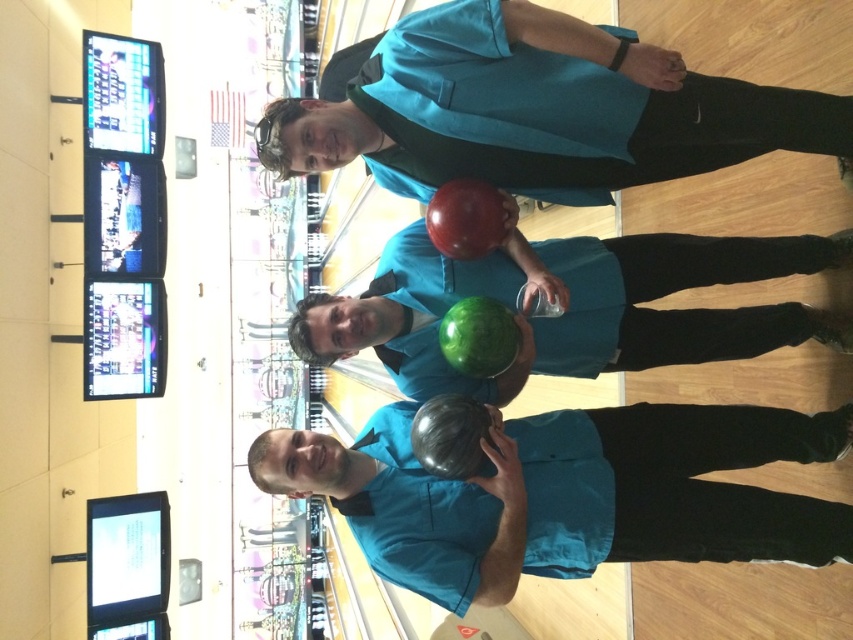
Between matte teal bowling ball at upper center and shiny green bowling ball at center, which one has more height?

Standing taller between the two is shiny green bowling ball at center.

From the picture: Does matte teal bowling ball at upper center have a lesser width compared to shiny green bowling ball at center?

Incorrect, matte teal bowling ball at upper center's width is not less than shiny green bowling ball at center's.

Is point (610, 36) behind point (677, 248)?

That is False.

In order to click on matte teal bowling ball at upper center in this screenshot , I will do `click(538, 113)`.

Is matte black bowling ball at center further to the viewer compared to shiny green bowling ball at center?

No, matte black bowling ball at center is closer to the viewer.

Is point (628, 422) less distant than point (654, 289)?

Yes, it is in front of point (654, 289).

Is point (508, 502) behind point (537, 333)?

No, it is in front of (537, 333).

Where is `matte black bowling ball at center`? This screenshot has width=853, height=640. matte black bowling ball at center is located at coordinates (569, 493).

Which is more to the left, matte black bowling ball at center or matte teal bowling ball at upper center?

Positioned to the left is matte teal bowling ball at upper center.

Measure the distance between point (498,506) and camera.

Point (498,506) and camera are 3.95 meters apart.

Looking at this image, who is more distant from viewer, (395,438) or (469,42)?

Point (395,438)

In order to click on matte black bowling ball at center in this screenshot , I will do `click(569, 493)`.